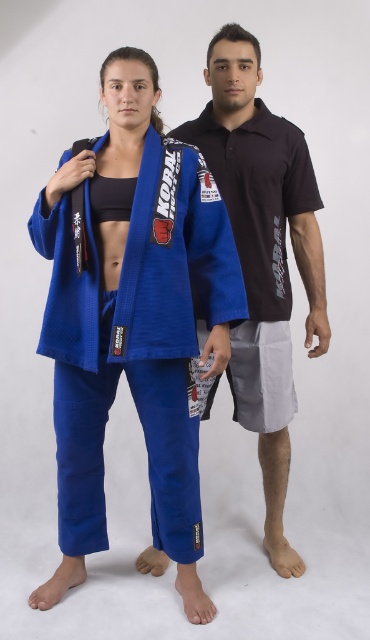
The image size is (370, 640). What do you see at coordinates (136, 340) in the screenshot? I see `blue fabric kimono at center` at bounding box center [136, 340].

Which is behind, point (145, 314) or point (318, 269)?

Positioned behind is point (318, 269).

You are a GUI agent. You are given a task and a screenshot of the screen. Output one action in this format:
    pyautogui.click(x=<x>, y=<y>)
    Task: Click on the blue fabric kimono at center
    The image size is (370, 640).
    Given the screenshot: What is the action you would take?
    pyautogui.click(x=136, y=340)